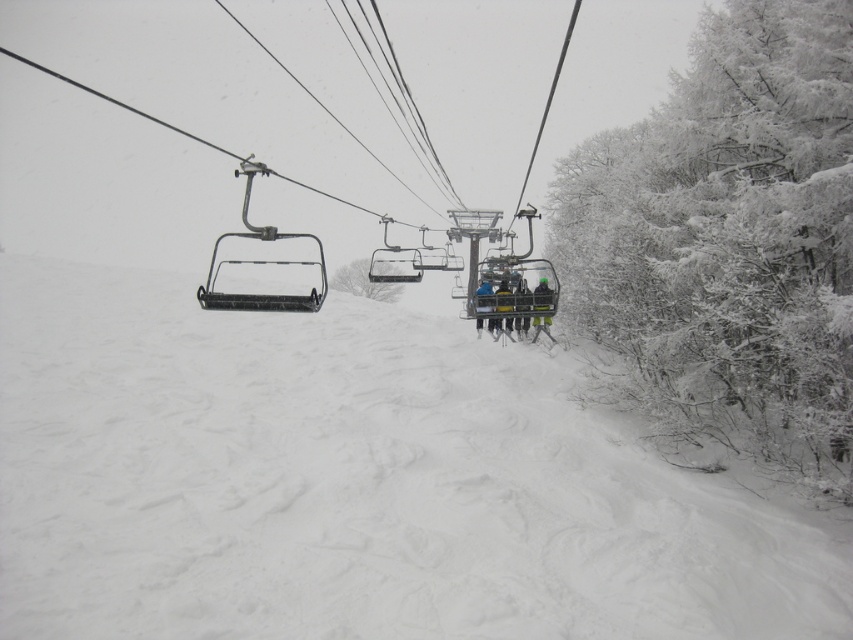
You are a photographer standing at the bottom of the slope and want to capture the dark blue fabric jacket at center in your photo. Where should you aim your camera to include the jacket in the frame?

You should aim your camera at the coordinates point (x=520, y=307) to include the dark blue fabric jacket at center in the frame.

Looking at this image, you are standing at the bottom of the slope and see the blue fabric jacket at center. If you want to reach the jacket, in which direction should you move? Please answer with either left, right, forward, or backward.

The blue fabric jacket at center is located at point 0.473 in the x coordinate and 0.567 in the y coordinate. Since you are at the bottom of the slope, moving forward would take you towards the center of the image where the jacket is located. Therefore, you should move forward.